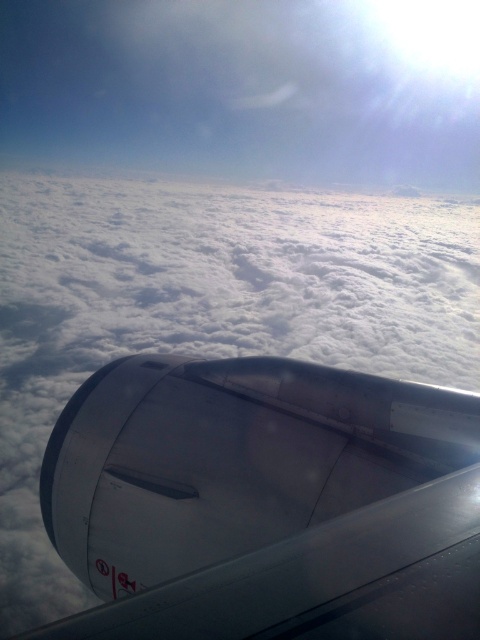
You are a passenger sitting in the aircraft and want to know if you can safely place your phone on the transparent glass airplane window at lower center without it falling off. The phone is 15 centimeters long. Is the distance between the metallic jet engine at center and the window sufficient to prevent the phone from slipping off?

The distance between the metallic jet engine at center and the transparent glass airplane window at lower center is 42.85 centimeters. Since the phone is only 15 centimeters long, the distance is more than enough to safely place the phone without it slipping off.

You are a passenger sitting near the window and want to take a photo of the metallic jet engine at center through the transparent glass airplane window at lower center. Will the entire engine fit in the frame of the window?

The metallic jet engine at center is larger in size than the transparent glass airplane window at lower center, so the entire engine will not fit in the frame of the window.

You are a flight attendant checking the aircraft window for safety. You notice the metallic jet engine at center and the transparent glass airplane window at lower center. Which object has a greater width?

The metallic jet engine at center has a greater width than the transparent glass airplane window at lower center.